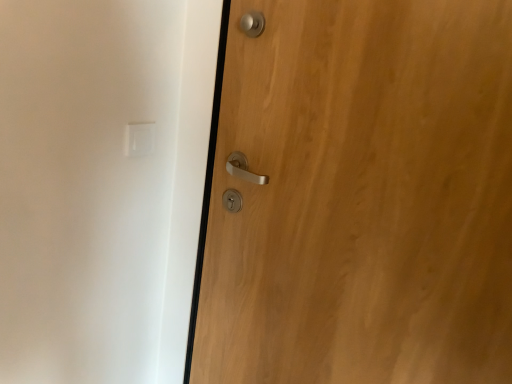
Question: Would you say wooden door at right contains white plastic light switch at upper left?

Choices:
 (A) no
 (B) yes

Answer: (A)

Question: Is wooden door at right beside white plastic light switch at upper left?

Choices:
 (A) yes
 (B) no

Answer: (B)

Question: From the image's perspective, is wooden door at right above white plastic light switch at upper left?

Choices:
 (A) yes
 (B) no

Answer: (B)

Question: Can you confirm if wooden door at right is thinner than white plastic light switch at upper left?

Choices:
 (A) yes
 (B) no

Answer: (B)

Question: Does wooden door at right have a smaller size compared to white plastic light switch at upper left?

Choices:
 (A) no
 (B) yes

Answer: (A)

Question: Could you tell me if wooden door at right is facing white plastic light switch at upper left?

Choices:
 (A) yes
 (B) no

Answer: (B)

Question: Does white plastic light switch at upper left appear on the right side of wooden door at right?

Choices:
 (A) yes
 (B) no

Answer: (B)

Question: Does white plastic light switch at upper left come behind wooden door at right?

Choices:
 (A) no
 (B) yes

Answer: (B)

Question: Is white plastic light switch at upper left shorter than wooden door at right?

Choices:
 (A) yes
 (B) no

Answer: (A)

Question: Is white plastic light switch at upper left directly adjacent to wooden door at right?

Choices:
 (A) no
 (B) yes

Answer: (A)

Question: Considering the relative positions of white plastic light switch at upper left and wooden door at right in the image provided, is white plastic light switch at upper left to the left of wooden door at right from the viewer's perspective?

Choices:
 (A) no
 (B) yes

Answer: (B)

Question: Does white plastic light switch at upper left have a greater height compared to wooden door at right?

Choices:
 (A) yes
 (B) no

Answer: (B)

Question: In the image, is wooden door at right on the left side or the right side of white plastic light switch at upper left?

Choices:
 (A) left
 (B) right

Answer: (B)